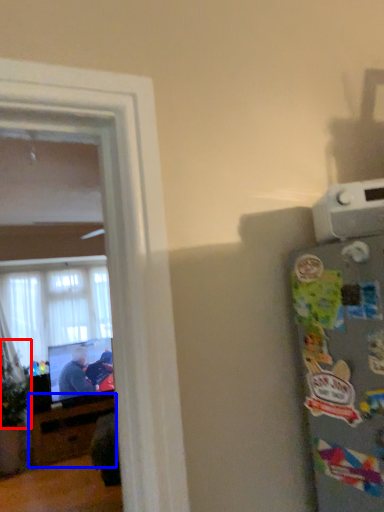
Question: Among these objects, which one is farthest to the camera, plant (highlighted by a red box) or entertainment center (highlighted by a blue box)?

Choices:
 (A) plant
 (B) entertainment center

Answer: (B)